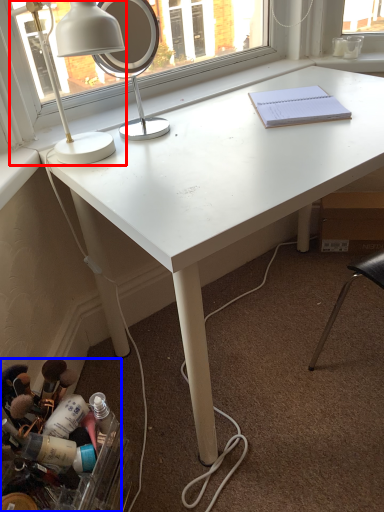
Question: Which object is closer to the camera taking this photo, lamp (highlighted by a red box) or toiletry (highlighted by a blue box)?

Choices:
 (A) lamp
 (B) toiletry

Answer: (B)